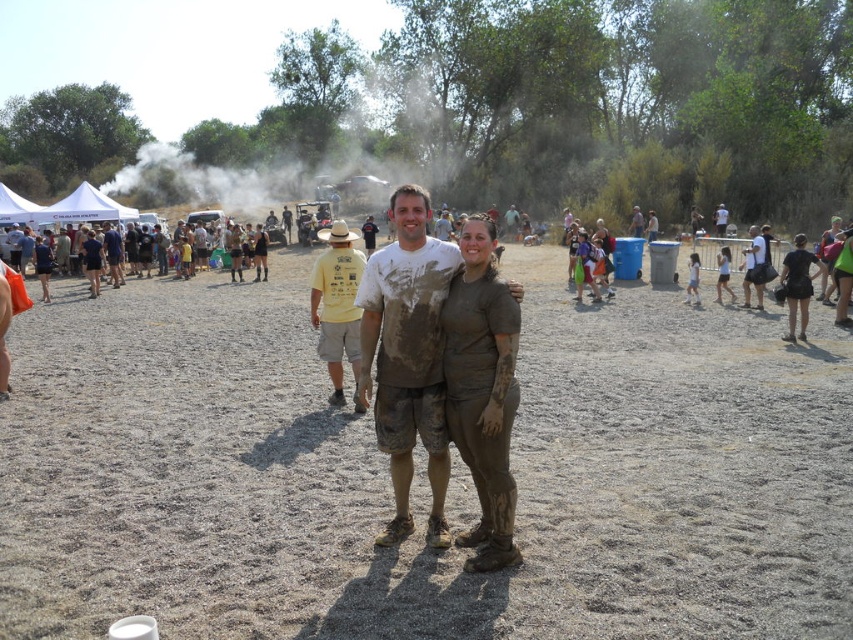
You are at an outdoor event in a park. You see the dusty brown ground at center and the white smoke at upper center. Which object is higher from the ground?

The white smoke at upper center is higher from the ground than the dusty brown ground at center because it is located above it.

You are a photographer at the event and want to capture a photo of the dusty brown ground at center without the white smoke at upper center appearing in the frame. Is this possible given their positions?

The dusty brown ground at center is in front of the white smoke at upper center, so it is possible to capture the dusty brown ground at center without the white smoke at upper center by adjusting the camera angle to exclude the background smoke.